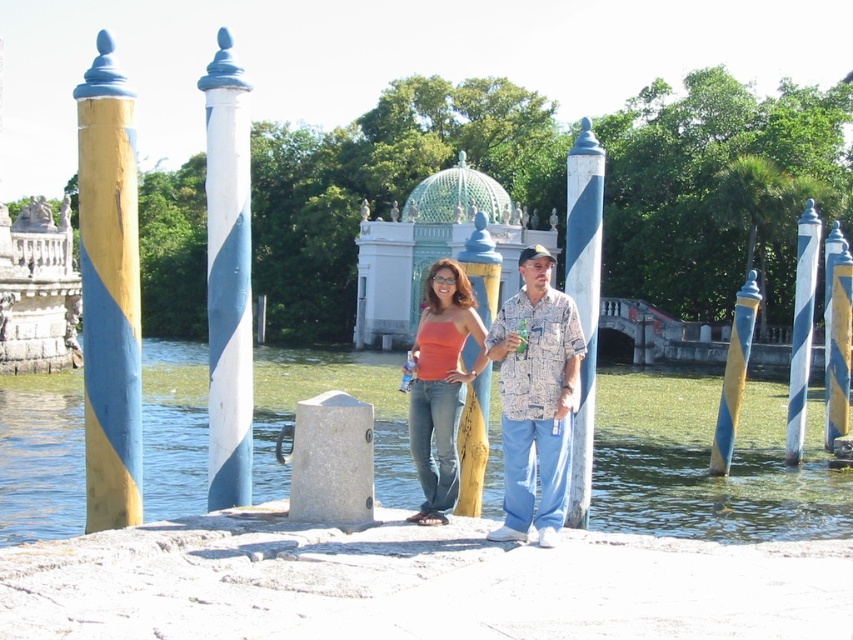
Question: Is orange matte tank top at center thinner than yellow painted wood post at center?

Choices:
 (A) no
 (B) yes

Answer: (A)

Question: Which point is closer to the camera taking this photo?

Choices:
 (A) (741, 314)
 (B) (426, 326)

Answer: (B)

Question: Among these objects, which one is farthest from the camera?

Choices:
 (A) matte orange tank top at center
 (B) blue/yellow striped post at right

Answer: (B)

Question: Is blue painted wood post at center closer to the viewer compared to blue/yellow striped post at right?

Choices:
 (A) yes
 (B) no

Answer: (A)

Question: Which object appears farthest from the camera in this image?

Choices:
 (A) yellow and blue striped post at left
 (B) green mosaic dome at center
 (C) orange matte tank top at center
 (D) blue and yellow striped pole at center right

Answer: (D)

Question: Does yellow and blue striped post at left have a smaller size compared to green mosaic dome at center?

Choices:
 (A) no
 (B) yes

Answer: (B)